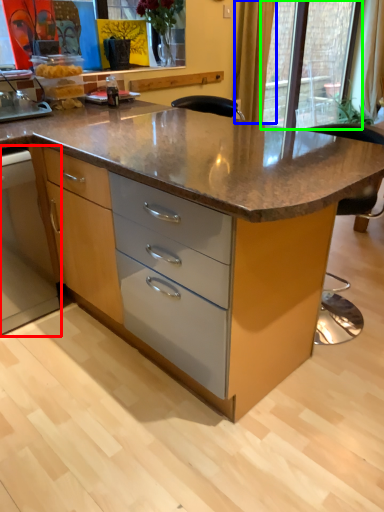
Question: Which object is positioned farthest from cabinetry (highlighted by a red box)? Select from curtain (highlighted by a blue box) and glass door (highlighted by a green box).

Choices:
 (A) curtain
 (B) glass door

Answer: (B)